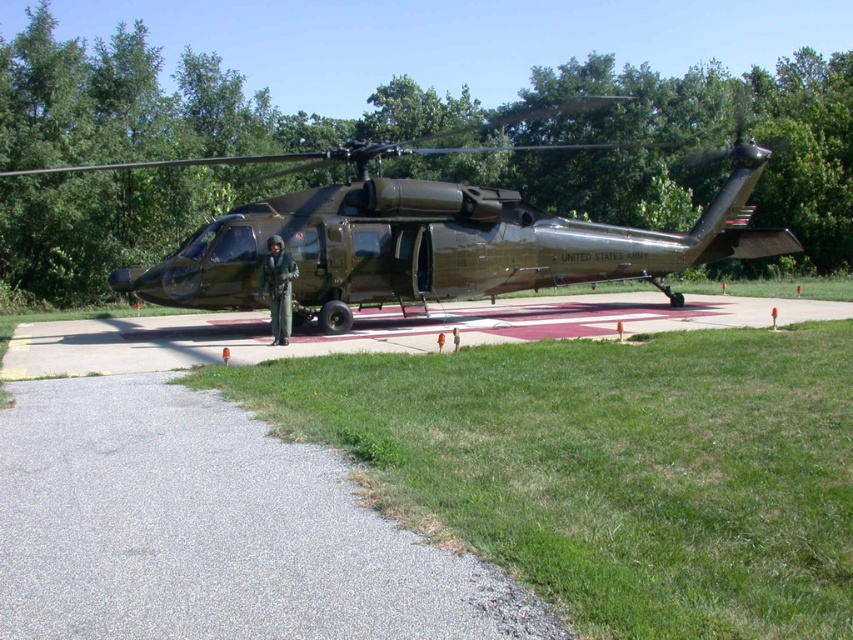
You are a drone operator trying to land a drone on the gray asphalt tarmac at lower left and the concrete tarmac at center. According to the scene, which tarmac is closer to you?

The gray asphalt tarmac at lower left is in front of the concrete tarmac at center, so it is closer to you.

You are a military technician assigned to inspect the matte black helicopter at center and the camouflage fabric uniform at center. From your position, which object is located to the right side?

The matte black helicopter at center is to the right of the camouflage fabric uniform at center, so the helicopter is on the right side.

You are a photographer trying to capture a photo of the matte black helicopter at center and the camouflage fabric uniform at center. Since you want both subjects to be clearly visible in the photo, which subject should you focus on first to ensure proper focus, considering their sizes?

The matte black helicopter at center is bigger than the camouflage fabric uniform at center, so you should focus on the matte black helicopter at center first to ensure proper focus, as larger objects generally require more precise focusing to capture all details clearly.